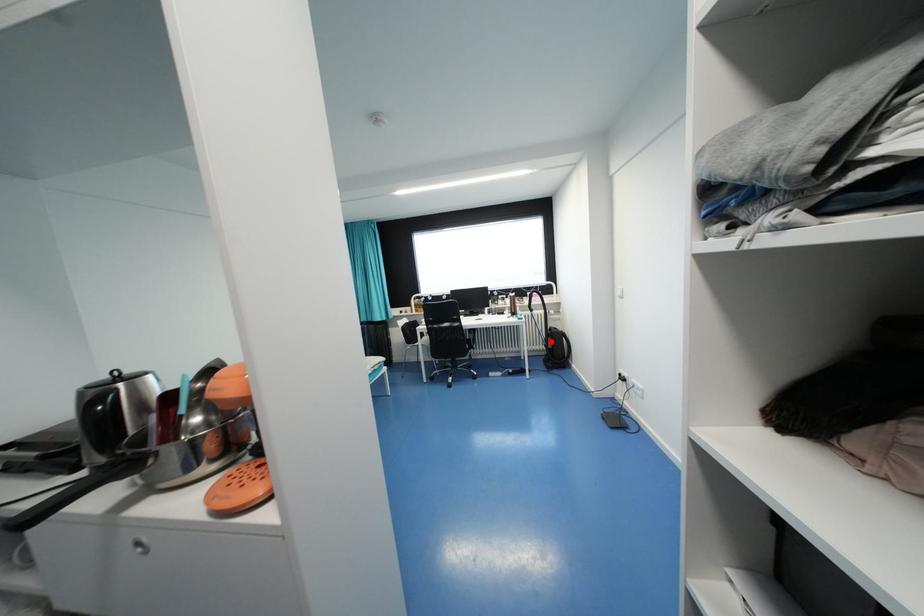
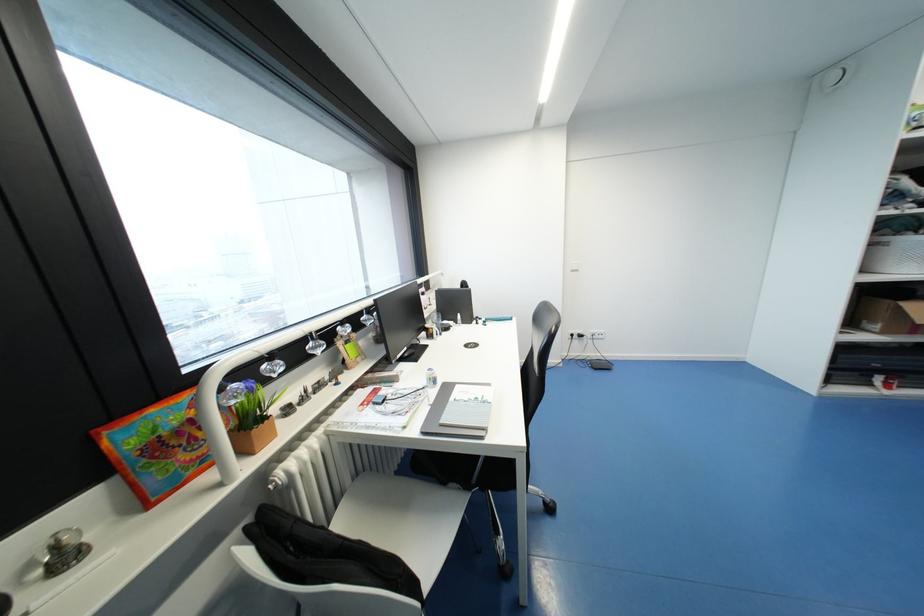
Question: I am providing you with two images of the same scene from different viewpoints. A red point is marked on the first image. Can you still see the location of the red point in image 2?

Choices:
 (A) Yes
 (B) No

Answer: (B)